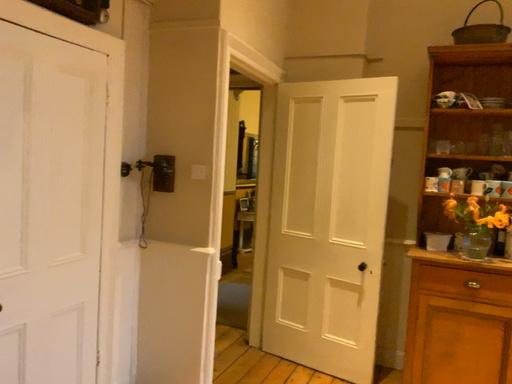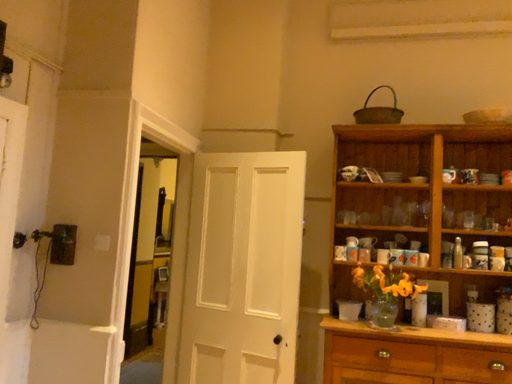
Question: How did the camera likely rotate when shooting the video?

Choices:
 (A) rotated right
 (B) rotated left

Answer: (A)